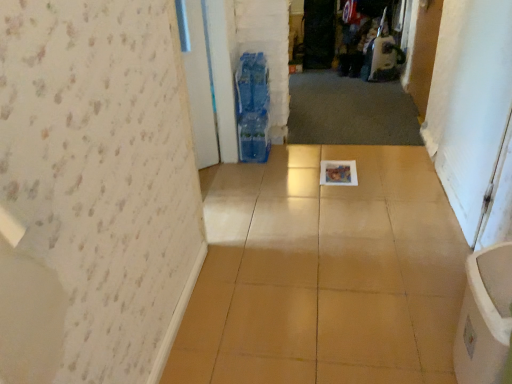
Question: From the image's perspective, is white glossy screen door at right, positioned as the 1th screen door in bottom-to-top order, under transparent plastic screen door at center, which is counted as the first screen door, starting from the left?

Choices:
 (A) no
 (B) yes

Answer: (B)

Question: Is white glossy screen door at right, which appears as the second screen door when viewed from the back, closer to camera compared to transparent plastic screen door at center, which is counted as the first screen door, starting from the left?

Choices:
 (A) no
 (B) yes

Answer: (B)

Question: From a real-world perspective, is white glossy screen door at right, positioned as the 1th screen door in bottom-to-top order, under transparent plastic screen door at center, the second screen door in the bottom-to-top sequence?

Choices:
 (A) no
 (B) yes

Answer: (A)

Question: Is white glossy screen door at right, acting as the 1th screen door starting from the right, further to camera compared to transparent plastic screen door at center, arranged as the 2th screen door when viewed from the right?

Choices:
 (A) no
 (B) yes

Answer: (A)

Question: Is white glossy screen door at right, the 2th screen door from the top, wider than transparent plastic screen door at center, the 2th screen door in the front-to-back sequence?

Choices:
 (A) no
 (B) yes

Answer: (A)

Question: Relative to transparent plastic screen door at center, the first screen door from the top, is wooden door at upper right in front or behind?

Choices:
 (A) front
 (B) behind

Answer: (A)

Question: From the image's perspective, is wooden door at upper right positioned above or below transparent plastic screen door at center, the 2th screen door in the front-to-back sequence?

Choices:
 (A) below
 (B) above

Answer: (A)

Question: In terms of width, does wooden door at upper right look wider or thinner when compared to transparent plastic screen door at center, the second screen door in the bottom-to-top sequence?

Choices:
 (A) wide
 (B) thin

Answer: (B)

Question: From their relative heights in the image, would you say wooden door at upper right is taller or shorter than transparent plastic screen door at center, which is counted as the first screen door, starting from the left?

Choices:
 (A) short
 (B) tall

Answer: (B)

Question: Is white glossy screen door at right, which is the 2th screen door in left-to-right order, wider or thinner than transparent plastic screen door at center, the 2th screen door in the front-to-back sequence?

Choices:
 (A) wide
 (B) thin

Answer: (B)

Question: In terms of height, does white glossy screen door at right, which is the 1th screen door from front to back, look taller or shorter compared to transparent plastic screen door at center, arranged as the 2th screen door when viewed from the right?

Choices:
 (A) tall
 (B) short

Answer: (A)

Question: From the image's perspective, is white glossy screen door at right, acting as the 1th screen door starting from the right, above or below transparent plastic screen door at center, the second screen door in the bottom-to-top sequence?

Choices:
 (A) below
 (B) above

Answer: (A)

Question: Is white glossy screen door at right, the 2th screen door from the top, in front of or behind transparent plastic screen door at center, the 2th screen door in the front-to-back sequence, in the image?

Choices:
 (A) behind
 (B) front

Answer: (B)

Question: From their relative heights in the image, would you say transparent plastic screen door at center, which is counted as the first screen door, starting from the left, is taller or shorter than white glossy screen door at right, positioned as the 1th screen door in bottom-to-top order?

Choices:
 (A) short
 (B) tall

Answer: (A)

Question: Considering their positions, is transparent plastic screen door at center, which is counted as the first screen door, starting from the left, located in front of or behind white glossy screen door at right, positioned as the 1th screen door in bottom-to-top order?

Choices:
 (A) front
 (B) behind

Answer: (B)